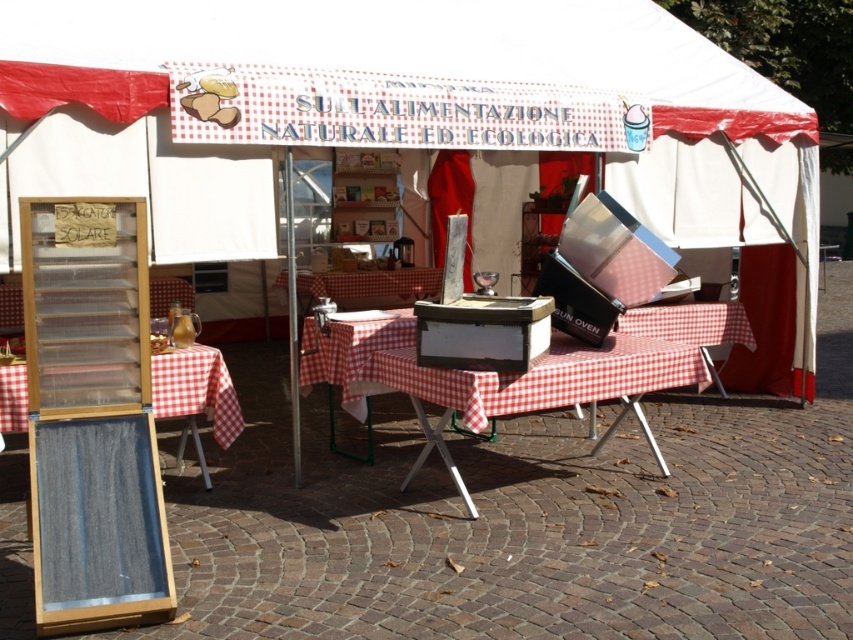
You are a customer at the outdoor market stall. You want to sit down to try a sample. Is the checkered fabric picnic table at center closer to you than the wooden chair at lower left?

The checkered fabric picnic table at center is in front of the wooden chair at lower left, so yes, it is closer to you.